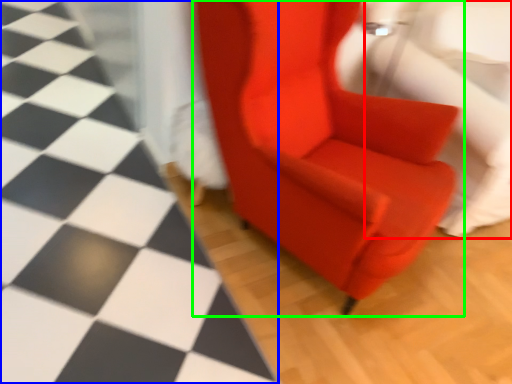
Question: Estimate the real-world distances between objects in this image. Which object is closer to swivel chair (highlighted by a red box), tile (highlighted by a blue box) or chair (highlighted by a green box)?

Choices:
 (A) tile
 (B) chair

Answer: (B)